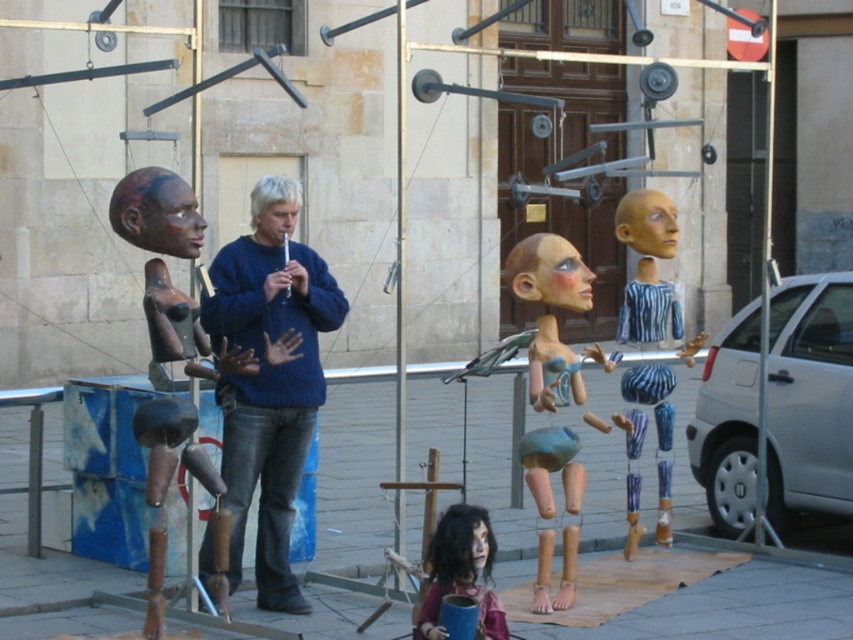
Can you confirm if blue sweater at center is smaller than smooth wooden head at center?

Actually, blue sweater at center might be larger than smooth wooden head at center.

Is blue sweater at center above smooth wooden head at center?

Incorrect, blue sweater at center is not positioned above smooth wooden head at center.

Is point (305, 257) positioned behind point (657, 198)?

No.

Identify the location of blue sweater at center. This screenshot has width=853, height=640. (x=270, y=387).

Does wooden doll at center come in front of matte brown head at center?

No, wooden doll at center is behind matte brown head at center.

From the picture: Can you confirm if wooden doll at center is bigger than matte brown head at center?

Yes.

Is point (564, 586) positioned in front of point (149, 179)?

No, (564, 586) is behind (149, 179).

At what (x,y) coordinates should I click in order to perform the action: click on wooden doll at center. Please return your answer as a coordinate pair (x, y). Image resolution: width=853 pixels, height=640 pixels. Looking at the image, I should click on (550, 314).

Does point (175, 240) come behind point (283, 228)?

No.

This screenshot has height=640, width=853. Identify the location of matte brown head at center. (170, 218).

The width and height of the screenshot is (853, 640). Describe the element at coordinates (170, 218) in the screenshot. I see `matte brown head at center` at that location.

The image size is (853, 640). Find the location of `matte brown head at center`. matte brown head at center is located at coordinates (170, 218).